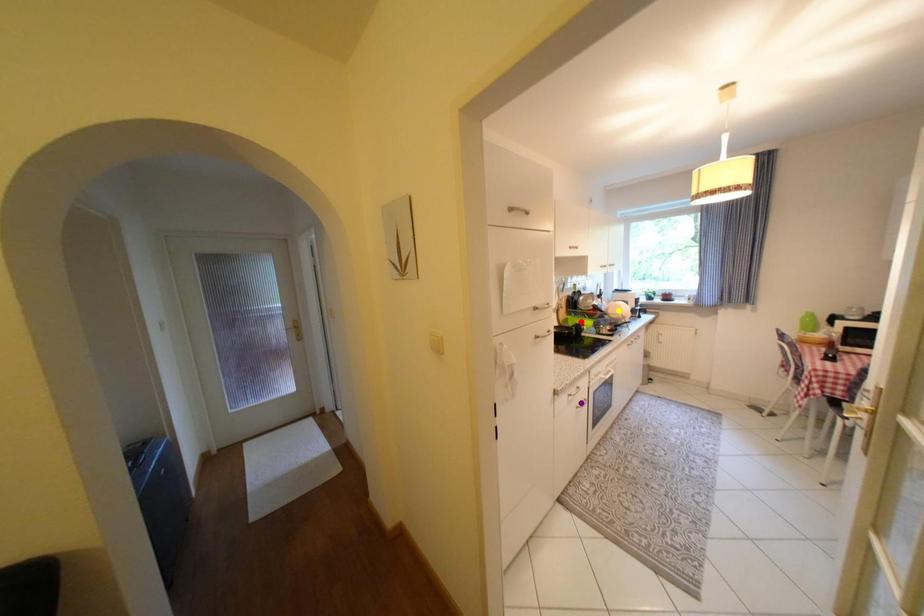
Order these from nearest to farthest:
1. yellow point
2. purple point
3. red point

purple point < yellow point < red point